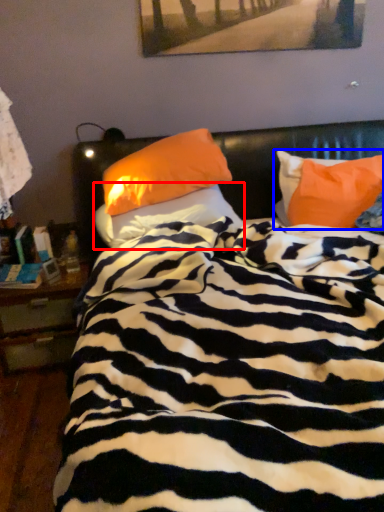
Question: Which object is further to the camera taking this photo, pillow (highlighted by a red box) or pillow (highlighted by a blue box)?

Choices:
 (A) pillow
 (B) pillow

Answer: (B)